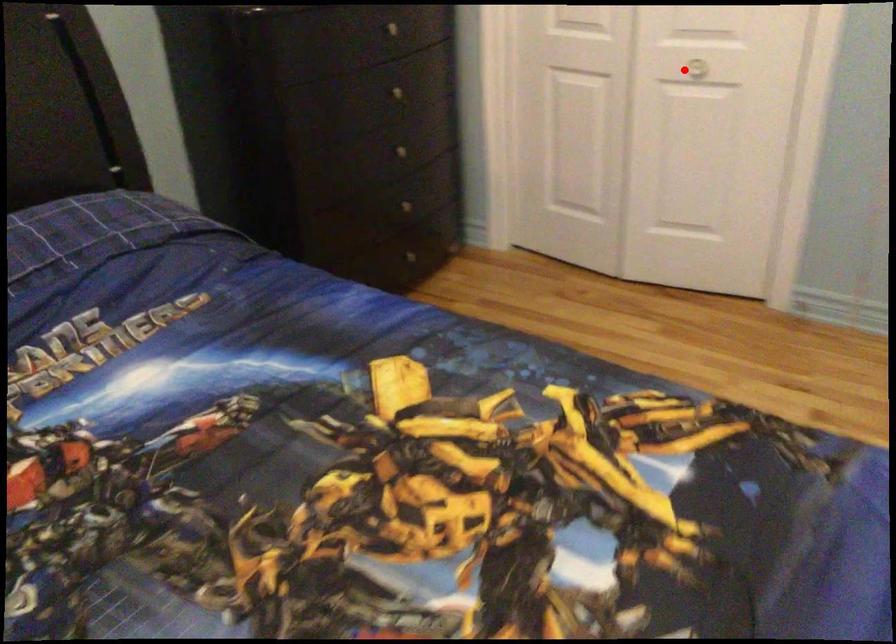
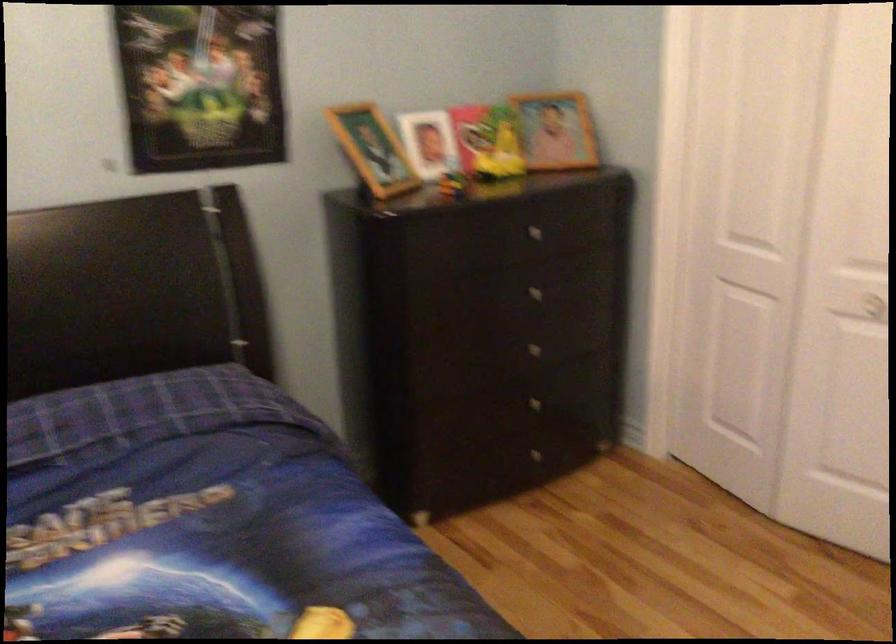
Question: A red point is marked in image1. In image2, is the corresponding 3D point closer to the camera or farther? Reply with the corresponding letter.

Choices:
 (A) The corresponding 3D point is closer.
 (B) The corresponding 3D point is farther.

Answer: (A)